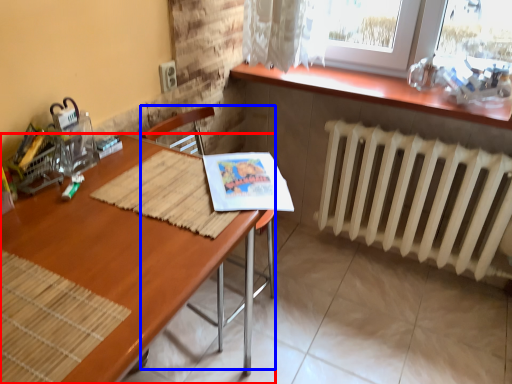
Question: Among these objects, which one is nearest to the camera, desk (highlighted by a red box) or armchair (highlighted by a blue box)?

Choices:
 (A) desk
 (B) armchair

Answer: (A)